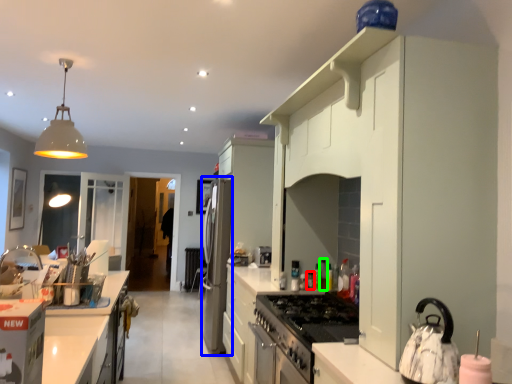
Question: Which object is the closest to the appliance (highlighted by a red box)? Choose among these: appliance (highlighted by a blue box) or bottle (highlighted by a green box).

Choices:
 (A) appliance
 (B) bottle

Answer: (B)